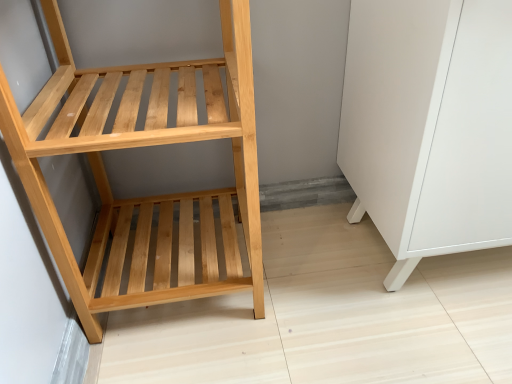
Question: From their relative heights in the image, would you say white matte cabinet at lower right is taller or shorter than natural wood shelf at left?

Choices:
 (A) short
 (B) tall

Answer: (A)

Question: Would you say white matte cabinet at lower right is inside or outside natural wood shelf at left?

Choices:
 (A) inside
 (B) outside

Answer: (B)

Question: In terms of width, does white matte cabinet at lower right look wider or thinner when compared to natural wood shelf at left?

Choices:
 (A) wide
 (B) thin

Answer: (A)

Question: From the image's perspective, is natural wood shelf at left positioned above or below white matte cabinet at lower right?

Choices:
 (A) above
 (B) below

Answer: (B)

Question: Is natural wood shelf at left spatially inside white matte cabinet at lower right, or outside of it?

Choices:
 (A) outside
 (B) inside

Answer: (A)

Question: Based on their sizes in the image, would you say natural wood shelf at left is bigger or smaller than white matte cabinet at lower right?

Choices:
 (A) small
 (B) big

Answer: (A)

Question: In the image, is natural wood shelf at left on the left side or the right side of white matte cabinet at lower right?

Choices:
 (A) right
 (B) left

Answer: (B)